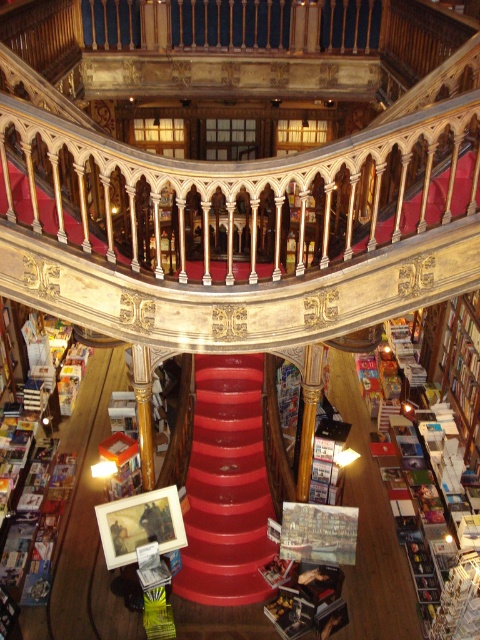
You are a customer in the bookstore and want to place a new book on the shelf. You have a hardcover book at center. Can you fit it on the smooth red staircase at center?

The smooth red staircase at center is bigger than the hardcover book at center, but the staircase is not a shelf. Therefore, you cannot place the hardcover book at center on the smooth red staircase at center.

You are standing at point (227,486) in the grand bookstore. What object are you standing on?

You are standing on the smooth red staircase at center located at point (227,486).

Consider the image. You are a customer in the bookstore and want to reach the top of the smooth red staircase at center. You notice a hardcover book at center nearby. Can you lift the book to place it on the staircase?

The smooth red staircase at center is much taller than the hardcover book at center, so you cannot reach the top of the staircase to place the book there.